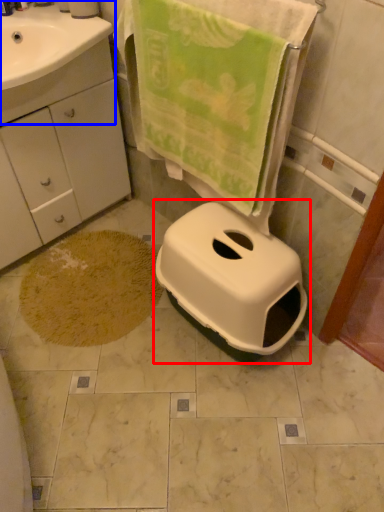
Question: Among these objects, which one is nearest to the camera, toilet (highlighted by a red box) or sink (highlighted by a blue box)?

Choices:
 (A) toilet
 (B) sink

Answer: (A)